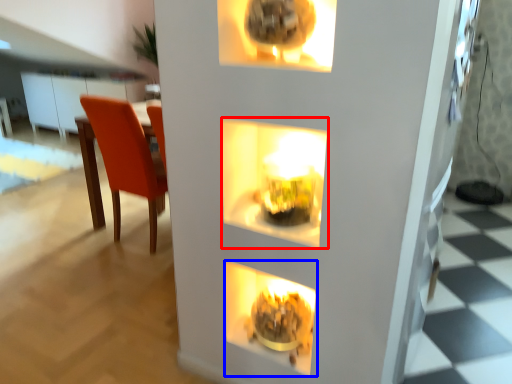
Question: Among these objects, which one is farthest to the camera, shelf (highlighted by a red box) or fireplace (highlighted by a blue box)?

Choices:
 (A) shelf
 (B) fireplace

Answer: (B)